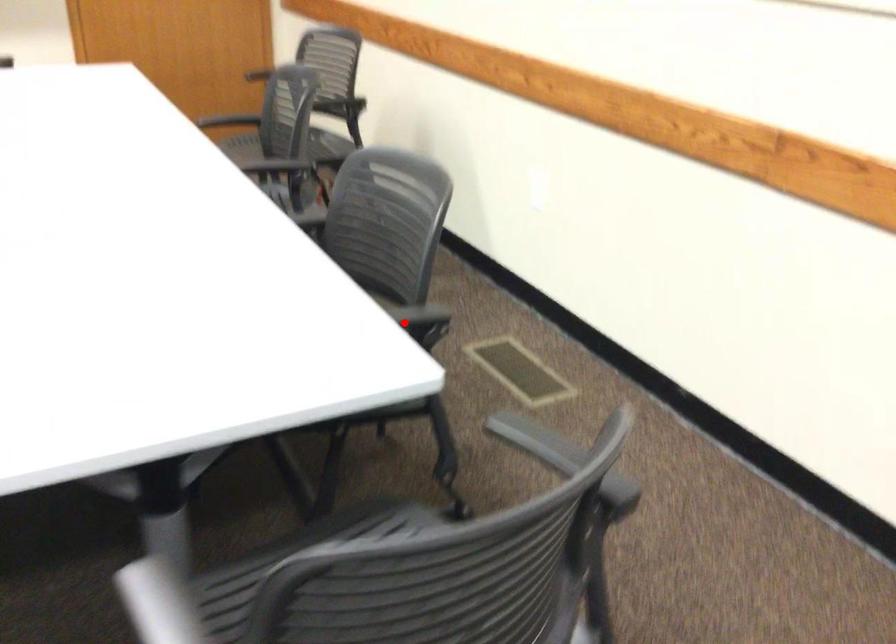
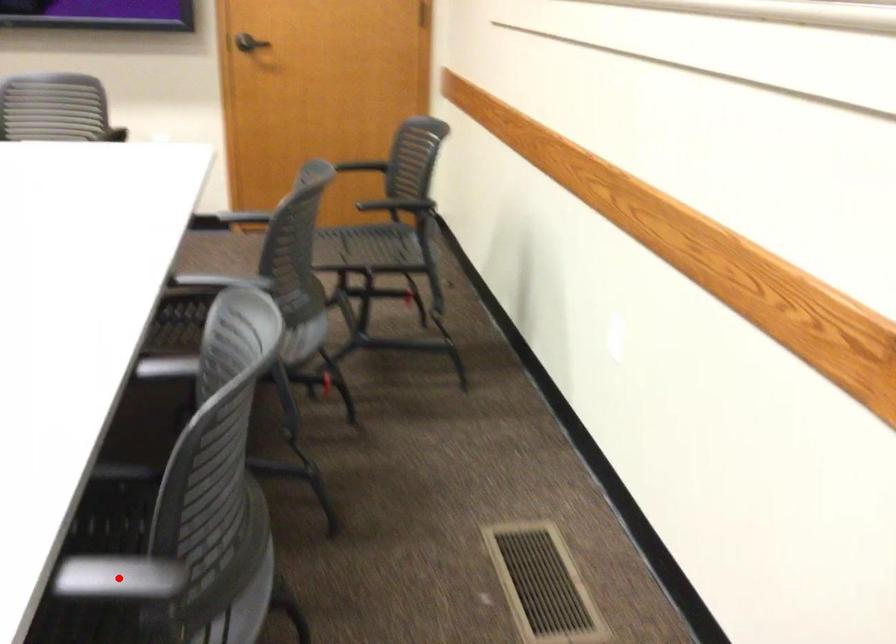
I am providing you with two images of the same scene from different viewpoints. A red point is marked on the first image and another point is marked on the second image. Are the points marked in image1 and image2 representing the same 3D position?

Yes